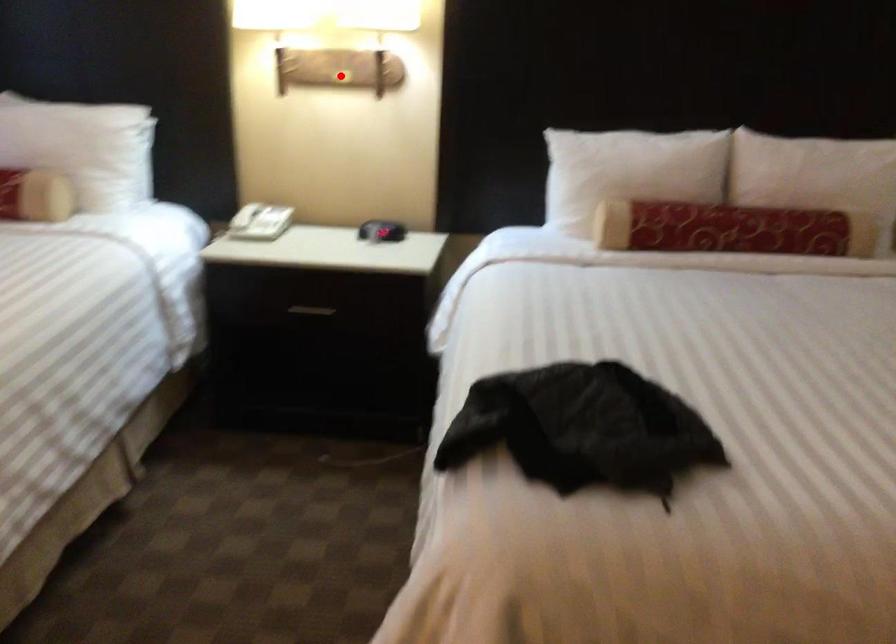
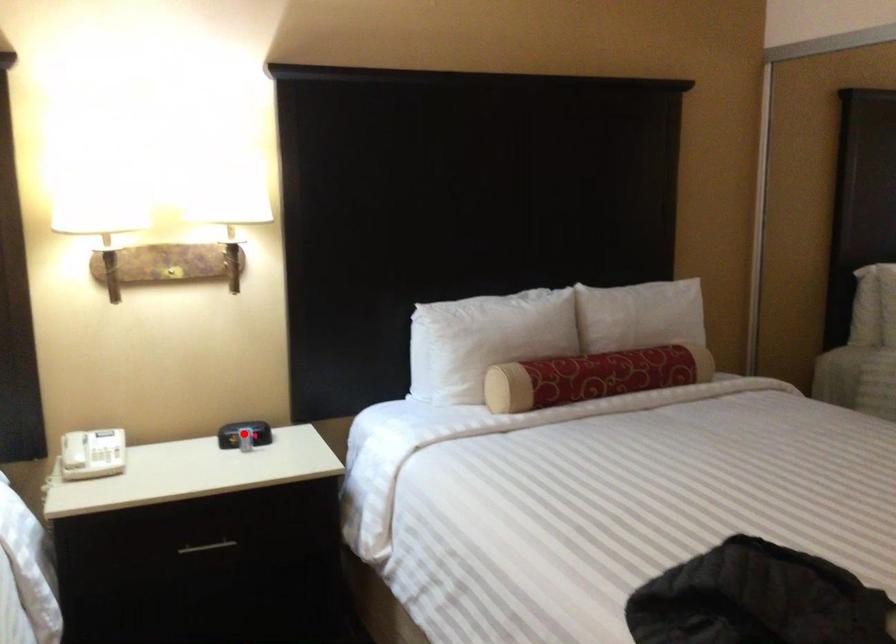
I am providing you with two images of the same scene from different viewpoints. A red point is marked on the first image and another point is marked on the second image. Do the highlighted points in image1 and image2 indicate the same real-world spot?

No